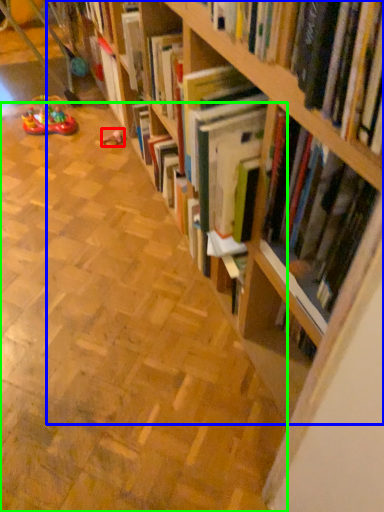
Question: Estimate the real-world distances between objects in this image. Which object is farther from toy (highlighted by a red box), bookcase (highlighted by a blue box) or aisle (highlighted by a green box)?

Choices:
 (A) bookcase
 (B) aisle

Answer: (A)